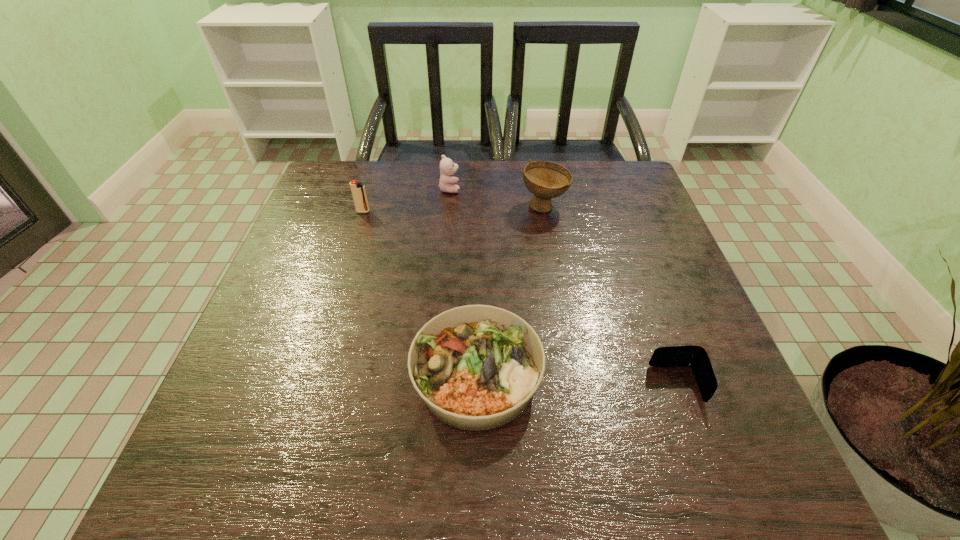
You are a GUI agent. You are given a task and a screenshot of the screen. Output one action in this format:
    pyautogui.click(x=<x>, y=<y>)
    Task: Click on the soup bowl
    
    Given the screenshot: What is the action you would take?
    pyautogui.click(x=546, y=180)

The image size is (960, 540). What are the coordinates of `teddy bear` in the screenshot? It's located at (447, 167).

You are a GUI agent. You are given a task and a screenshot of the screen. Output one action in this format:
    pyautogui.click(x=<x>, y=<y>)
    Task: Click on the leftmost object
    Image resolution: width=960 pixels, height=540 pixels.
    Given the screenshot: What is the action you would take?
    pyautogui.click(x=358, y=191)

Identify the location of salad plate. Image resolution: width=960 pixels, height=540 pixels. (476, 367).

Find the location of a particular element. The height and width of the screenshot is (540, 960). the rightmost object is located at coordinates (695, 357).

The image size is (960, 540). I want to click on the shortest object, so click(x=695, y=357).

Find the location of a particular element. Image resolution: width=960 pixels, height=540 pixels. vacant space situated on the right of the soup bowl is located at coordinates (649, 206).

The width and height of the screenshot is (960, 540). Identify the location of vacant region located 0.360m at the face of the teddy bear. (587, 188).

Where is `vacant space located 0.270m on the right of the igniter`? The image size is (960, 540). vacant space located 0.270m on the right of the igniter is located at coordinates (470, 212).

This screenshot has width=960, height=540. Find the location of `free location located on the left of the salad plate`. free location located on the left of the salad plate is located at coordinates (228, 376).